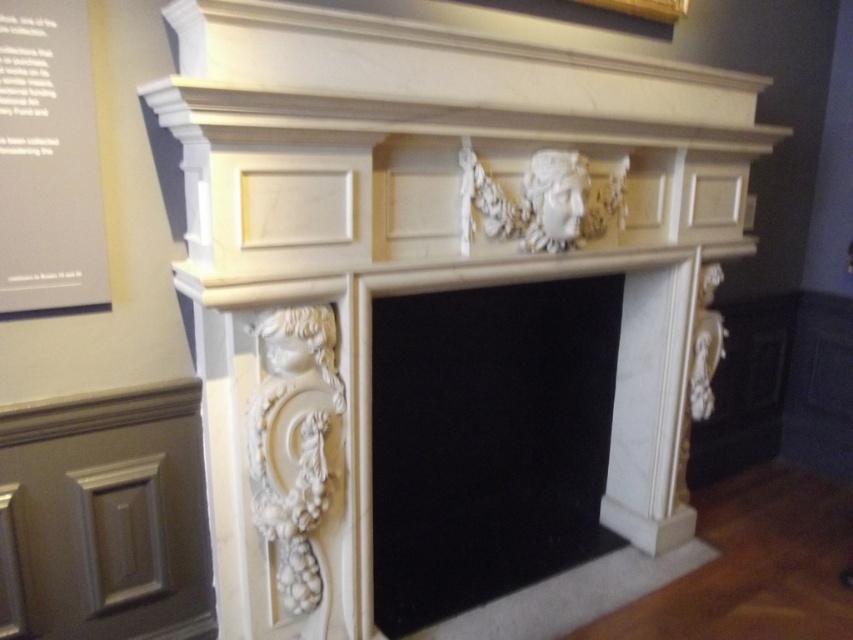
Question: Considering the relative positions of white paper at upper left and wooden picture frame at upper center in the image provided, where is white paper at upper left located with respect to wooden picture frame at upper center?

Choices:
 (A) below
 (B) above

Answer: (A)

Question: Estimate the real-world distances between objects in this image. Which object is closer to the white marble fireplace at center?

Choices:
 (A) wooden picture frame at upper center
 (B) white paper at upper left

Answer: (A)

Question: Does white marble fireplace at center have a smaller size compared to white paper at upper left?

Choices:
 (A) yes
 (B) no

Answer: (B)

Question: Can you confirm if white marble fireplace at center is wider than white paper at upper left?

Choices:
 (A) yes
 (B) no

Answer: (A)

Question: Which object is closer to the camera taking this photo?

Choices:
 (A) white paper at upper left
 (B) white marble fireplace at center

Answer: (A)

Question: Based on their relative distances, which object is farther from the white marble fireplace at center?

Choices:
 (A) white paper at upper left
 (B) wooden picture frame at upper center

Answer: (A)